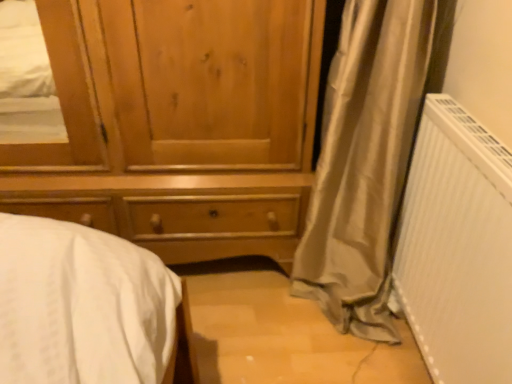
What do you see at coordinates (457, 247) in the screenshot? I see `white plastic radiator at right` at bounding box center [457, 247].

This screenshot has width=512, height=384. I want to click on white plastic radiator at right, so click(x=457, y=247).

What is the approximate width of white plastic radiator at right?

white plastic radiator at right is 3.01 inches in width.

Where is `white plastic radiator at right`? white plastic radiator at right is located at coordinates (457, 247).